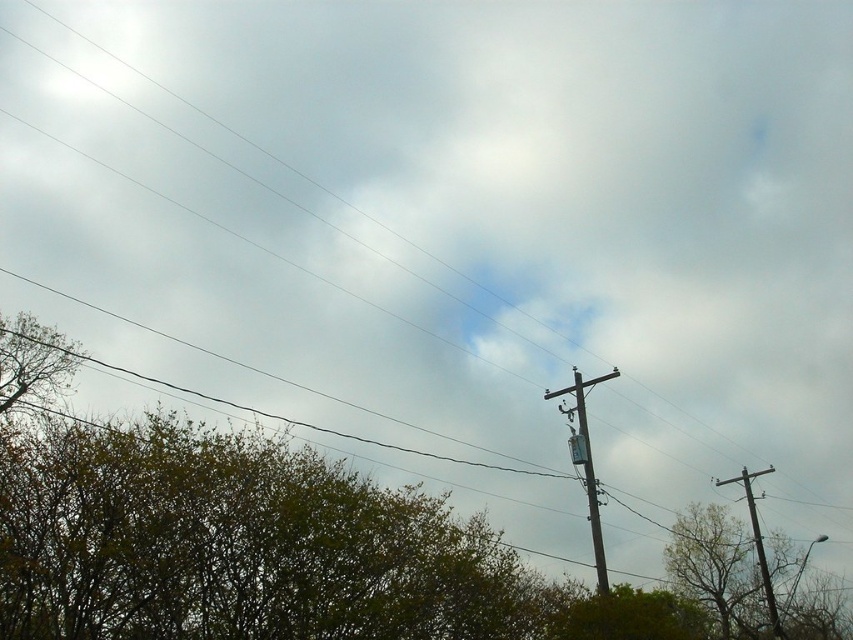
Question: Can you confirm if brown wooden telegraph pole at upper right is positioned to the right of white plastic street sign at center?

Choices:
 (A) yes
 (B) no

Answer: (A)

Question: Which is nearer to the white plastic street sign at center?

Choices:
 (A) green leafy tree at lower center
 (B) gray metallic telegraph pole at center-right
 (C) green leafy tree at lower left
 (D) brown wooden telegraph pole at upper right

Answer: (B)

Question: Does green leafy tree at lower left have a lesser width compared to green leafy tree at lower center?

Choices:
 (A) no
 (B) yes

Answer: (A)

Question: Which object is the farthest from the green leafy tree at lower left?

Choices:
 (A) gray metallic telegraph pole at center-right
 (B) green leafy tree at lower right
 (C) green leafy tree at lower center

Answer: (B)

Question: Can you confirm if green leafy tree at lower left is bigger than gray metallic telegraph pole at center-right?

Choices:
 (A) yes
 (B) no

Answer: (A)

Question: Based on their relative distances, which object is farther from the white plastic street sign at center?

Choices:
 (A) gray metallic telegraph pole at center-right
 (B) green leafy tree at lower left
 (C) green leafy tree at lower center

Answer: (B)